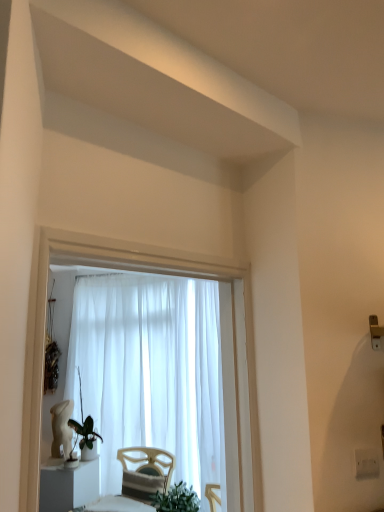
Question: Which is correct: white sheer curtain at center is inside white glossy statue at lower left, or outside of it?

Choices:
 (A) outside
 (B) inside

Answer: (A)

Question: From the image's perspective, is white sheer curtain at center above or below white glossy statue at lower left?

Choices:
 (A) below
 (B) above

Answer: (B)

Question: Estimate the real-world distances between objects in this image. Which object is closer to the green matte plant at lower left?

Choices:
 (A) white glossy statue at lower left
 (B) white plastic electric outlet at lower right
 (C) white sheer curtain at center

Answer: (A)

Question: Which object is positioned farthest from the white sheer curtain at center?

Choices:
 (A) white plastic electric outlet at lower right
 (B) white glossy statue at lower left
 (C) green matte plant at lower left

Answer: (A)